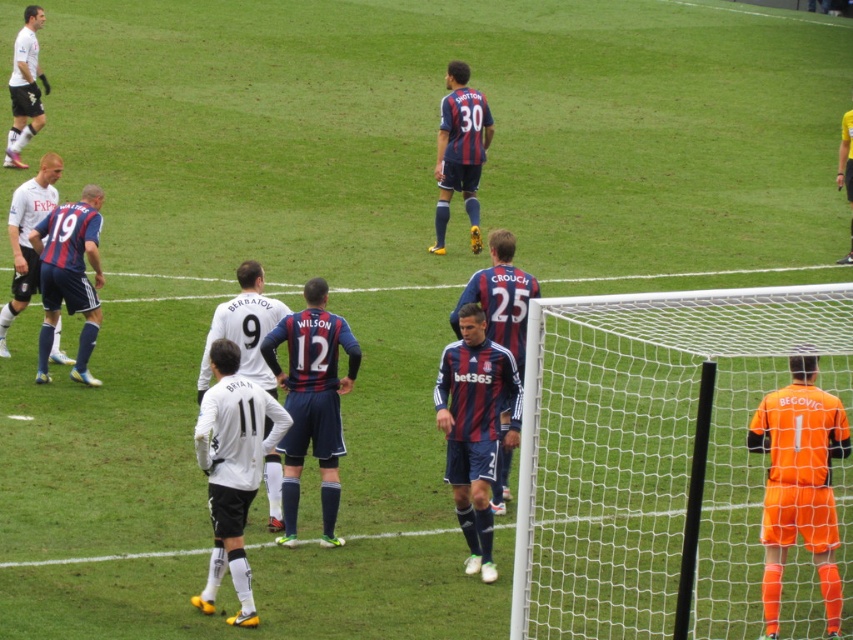
You are a soccer player positioned at the edge of the field. You see the striped jersey at center and the matte white jersey at left. Which player is closer to you?

The striped jersey at center is closer to you because it is in front of the matte white jersey at left.

You are a soccer player trying to score a goal. You see the orange matte jersey at right at point (799, 483). Is the goalkeeper blocking your shot to the left side of the goal?

The orange matte jersey at right is located at point (799, 483), which is on the right side of the goal. Therefore, the goalkeeper is blocking your shot to the left side of the goal.

You are standing at the point labeled as point (x=782, y=449) on the soccer field. You want to throw a ball to your teammate who is exactly 10 meters away from you. Is the goalkeeper in orange near the goalpost within your throwing range?

The distance between you and the goalkeeper in orange near the goalpost is 9.46 meters, which is within the 10 meters range. Yes, the goalkeeper is within your throwing range.